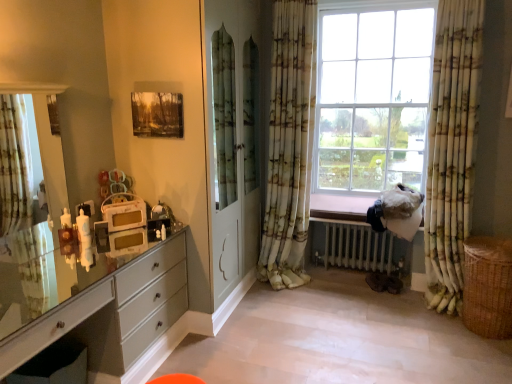
This screenshot has height=384, width=512. In order to click on vacant space in front of green and white textured curtain at right, which is counted as the first curtain, starting from the right in this screenshot , I will do `click(435, 329)`.